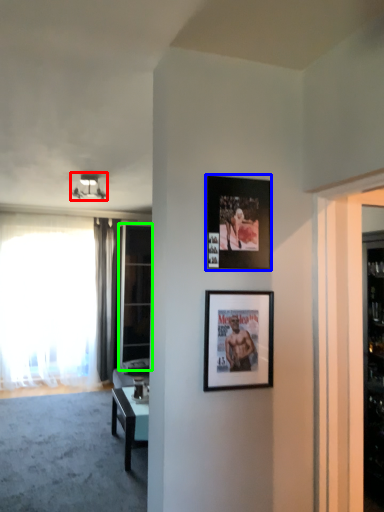
Question: Based on their relative distances, which object is nearer to light fixture (highlighted by a red box)? Choose from picture frame (highlighted by a blue box) and glass door (highlighted by a green box).

Choices:
 (A) picture frame
 (B) glass door

Answer: (B)